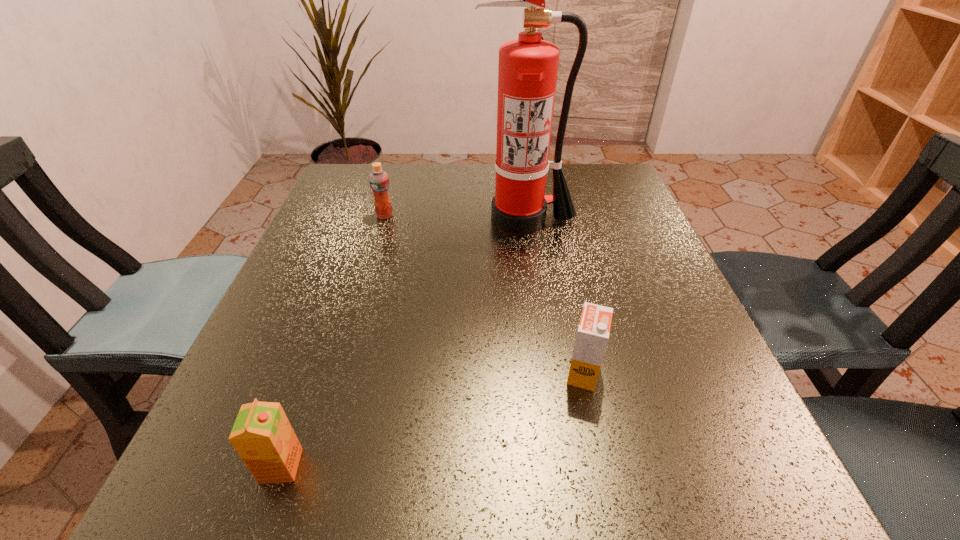
In the image, there is a desktop. Where is `free space at the far left corner`? Image resolution: width=960 pixels, height=540 pixels. free space at the far left corner is located at coordinates (332, 181).

This screenshot has width=960, height=540. In order to click on blank space at the far right corner of the desktop in this screenshot , I will do `click(621, 171)`.

Image resolution: width=960 pixels, height=540 pixels. What are the coordinates of `vacant space that's between the nearest object and the second farthest orange juice` in the screenshot? It's located at coord(432,419).

Find the location of a particular element. This screenshot has height=540, width=960. vacant area between the tallest object and the nearest orange juice is located at coordinates (402, 342).

Locate an element on the screen. The width and height of the screenshot is (960, 540). vacant point located between the third farthest object and the tallest object is located at coordinates (553, 296).

Locate an element on the screen. vacant area that lies between the nearest orange juice and the fire extinguisher is located at coordinates (402, 342).

Find the location of a particular element. Image resolution: width=960 pixels, height=540 pixels. free space that is in between the nearest orange juice and the farthest orange juice is located at coordinates (333, 341).

The height and width of the screenshot is (540, 960). I want to click on vacant area between the tallest object and the second nearest object, so click(x=553, y=296).

Image resolution: width=960 pixels, height=540 pixels. What are the coordinates of `vacant point located between the fire extinguisher and the rightmost orange juice` in the screenshot? It's located at (553, 296).

Where is `vacant area that lies between the nearest orange juice and the farthest orange juice`? Image resolution: width=960 pixels, height=540 pixels. vacant area that lies between the nearest orange juice and the farthest orange juice is located at coordinates (333, 341).